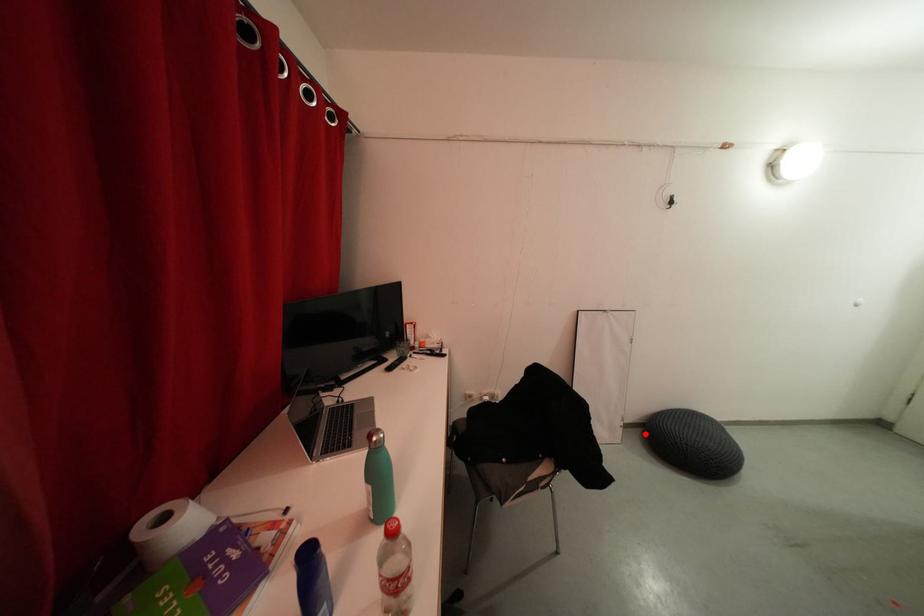
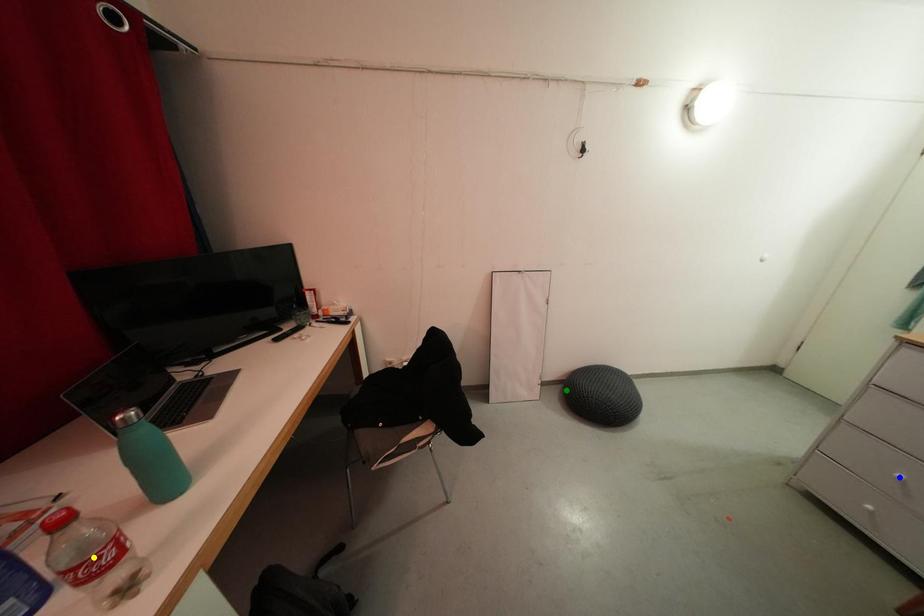
Question: I am providing you with two images of the same scene from different viewpoints. A red point is marked on the first image. You are given multiple points on the second image. Which spot in image 2 lines up with the point in image 1?

Choices:
 (A) green point
 (B) blue point
 (C) yellow point

Answer: (A)